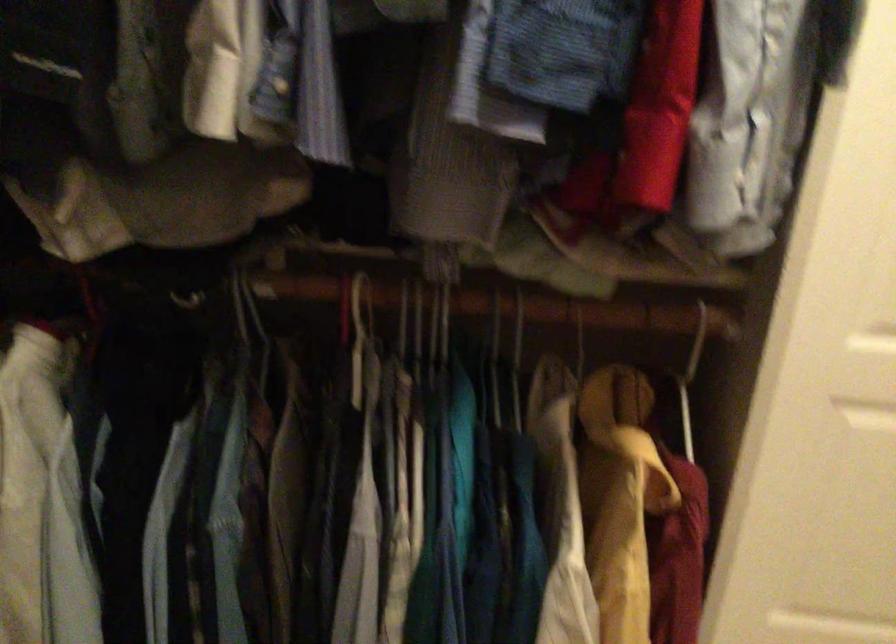
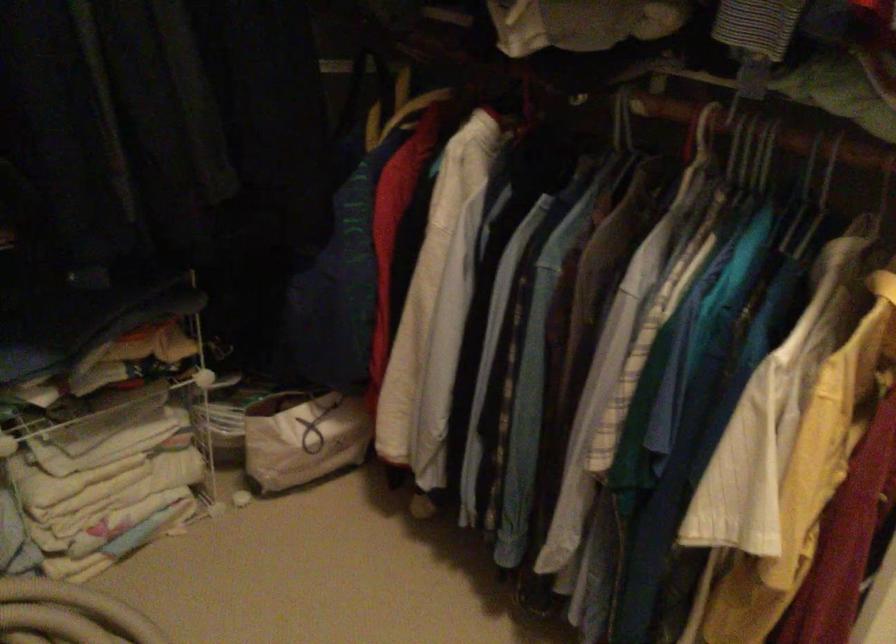
In the second image, find the point that corresponds to the point at 449,319 in the first image.

(767, 154)